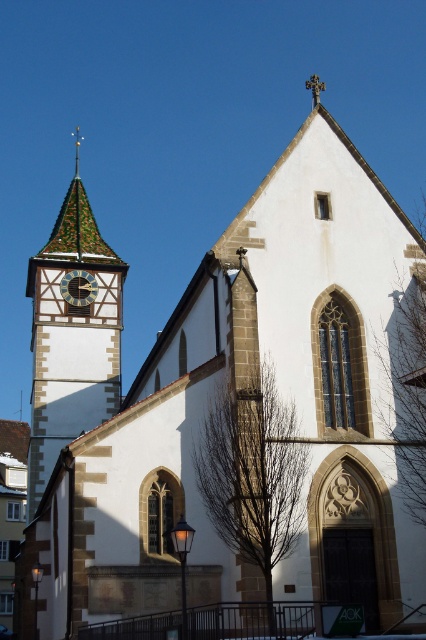
Question: Can you confirm if green-tiled clock tower at left is positioned to the left of matte black clock at upper left?

Choices:
 (A) no
 (B) yes

Answer: (B)

Question: Can you confirm if green-tiled clock tower at left is thinner than matte black clock at upper left?

Choices:
 (A) yes
 (B) no

Answer: (B)

Question: Which of the following is the closest to the observer?

Choices:
 (A) (83, 300)
 (B) (98, 256)

Answer: (A)

Question: Does green-tiled clock tower at left have a smaller size compared to matte black clock at upper left?

Choices:
 (A) yes
 (B) no

Answer: (B)

Question: Which point is farther from the camera taking this photo?

Choices:
 (A) (106, 276)
 (B) (77, 273)

Answer: (A)